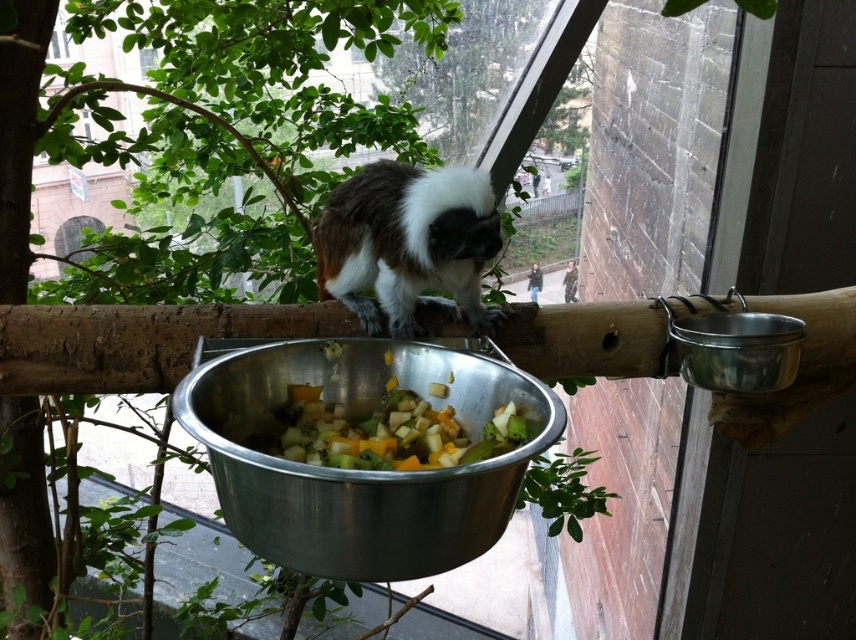
Looking at this image, you are a zookeeper standing outside the enclosure. You want to place a new fruit bowl for the fluffy white monkey at center. The bowl must be placed within a 0.5 meter radius of the monkey. Where should you place the bowl?

The fluffy white monkey at center is located at coordinates point (407, 243). To place the bowl within a 0.5 meter radius, position it near the monkey at those coordinates.

You are a zookeeper trying to feed the fluffy white monkey at center. The multicolored diced vegetables at center are its favorite food. To reach the vegetables, the monkey needs to move towards the left. Is the monkey currently positioned to the left or right of the vegetables?

The fluffy white monkey at center is to the left of multicolored diced vegetables at center, so the monkey is already positioned to the left of the vegetables and can reach them without moving further left.

You are a zookeeper who needs to place a new feeding tray for the tamarin. The tray must be placed at the point marked by the coordinates point (360, 468). Where exactly should you place the new feeding tray?

The point (360, 468) is on the metallic silver bowl at center, so you should place the new feeding tray on the metallic silver bowl at center.